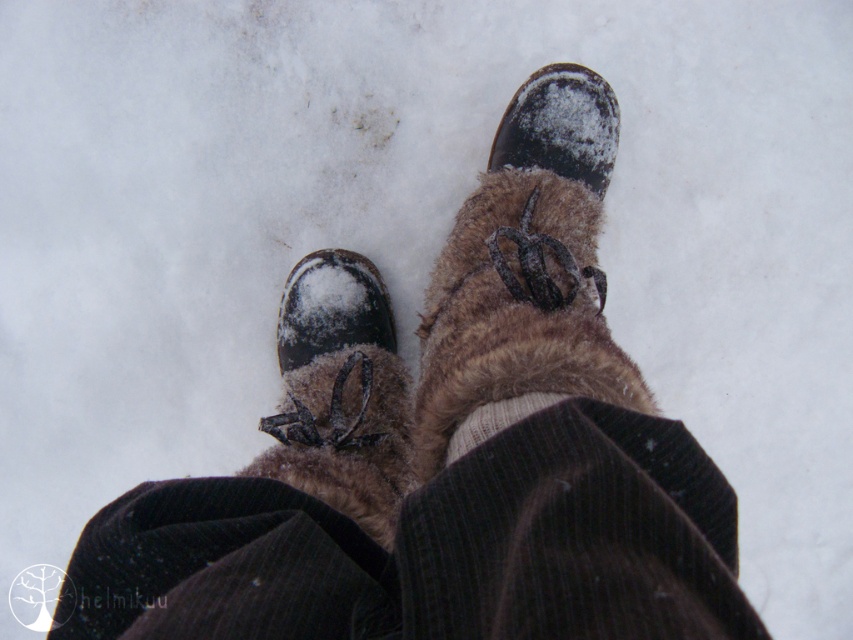
Question: Does brown fuzzy boot at center appear under fuzzy brown boot at center?

Choices:
 (A) no
 (B) yes

Answer: (A)

Question: Can you confirm if brown fuzzy boot at center is positioned to the right of fuzzy brown boot at center?

Choices:
 (A) yes
 (B) no

Answer: (A)

Question: Can you confirm if brown fuzzy boot at center is positioned below white knitted sock at center?

Choices:
 (A) no
 (B) yes

Answer: (A)

Question: Which object is positioned closest to the white knitted sock at center?

Choices:
 (A) fuzzy brown boot at center
 (B) brown fuzzy boot at center

Answer: (B)

Question: Estimate the real-world distances between objects in this image. Which object is closer to the brown fuzzy boot at center?

Choices:
 (A) fuzzy brown boot at center
 (B) white knitted sock at center

Answer: (A)

Question: Which point is closer to the camera?

Choices:
 (A) brown fuzzy boot at center
 (B) fuzzy brown boot at center
 (C) white knitted sock at center

Answer: (C)